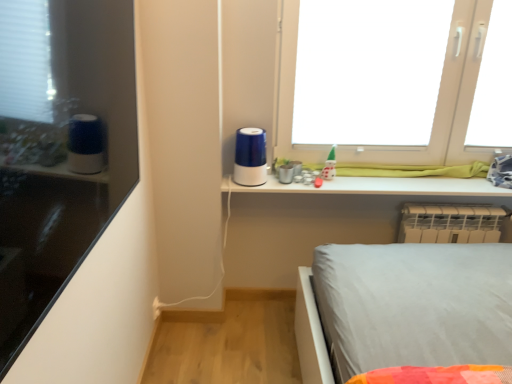
Question: Would you say white plastic radiator at lower right contains green glossy toy at upper center?

Choices:
 (A) no
 (B) yes

Answer: (A)

Question: From the image's perspective, is white plastic radiator at lower right on green glossy toy at upper center?

Choices:
 (A) yes
 (B) no

Answer: (B)

Question: Is white plastic radiator at lower right not close to green glossy toy at upper center?

Choices:
 (A) yes
 (B) no

Answer: (B)

Question: Is white plastic radiator at lower right facing towards green glossy toy at upper center?

Choices:
 (A) yes
 (B) no

Answer: (B)

Question: From a real-world perspective, is white plastic radiator at lower right on green glossy toy at upper center?

Choices:
 (A) no
 (B) yes

Answer: (A)

Question: Can you confirm if white plastic radiator at lower right is bigger than green glossy toy at upper center?

Choices:
 (A) yes
 (B) no

Answer: (A)

Question: Is white plastic radiator at lower right inside matte black shelf at left?

Choices:
 (A) no
 (B) yes

Answer: (A)

Question: From a real-world perspective, is matte black shelf at left over white plastic radiator at lower right?

Choices:
 (A) yes
 (B) no

Answer: (A)

Question: Is matte black shelf at left positioned with its back to white plastic radiator at lower right?

Choices:
 (A) yes
 (B) no

Answer: (B)

Question: Are matte black shelf at left and white plastic radiator at lower right beside each other?

Choices:
 (A) no
 (B) yes

Answer: (A)

Question: From the image's perspective, is matte black shelf at left under white plastic radiator at lower right?

Choices:
 (A) yes
 (B) no

Answer: (B)

Question: Is the position of matte black shelf at left less distant than that of white plastic radiator at lower right?

Choices:
 (A) yes
 (B) no

Answer: (A)

Question: Does white plastic radiator at lower right have a lesser height compared to transparent plastic window screen at upper right?

Choices:
 (A) yes
 (B) no

Answer: (A)